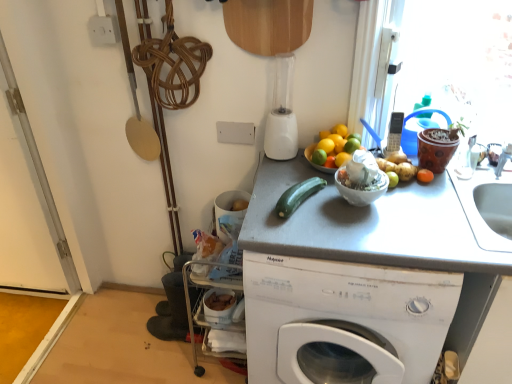
Question: Would you say gray matte counter top at center is inside or outside green smooth-textured zucchini at center?

Choices:
 (A) outside
 (B) inside

Answer: (A)

Question: Looking at the image, does gray matte counter top at center seem bigger or smaller compared to green smooth-textured zucchini at center?

Choices:
 (A) big
 (B) small

Answer: (A)

Question: Based on their relative distances, which object is farther from the white plastic phone at upper right?

Choices:
 (A) orange matte at upper right, the 2th orange viewed from the top
 (B) green matte lime at upper right, which is the second lime from left to right
 (C) green matte lime at center, positioned as the 1th lime in left-to-right order
 (D) orange matte at upper center, which is counted as the 1th orange, starting from the top
 (E) white plastic blender at upper center

Answer: (E)

Question: Which is farther from the gray matte counter top at center?

Choices:
 (A) orange matte at right
 (B) white matte washing machine at center
 (C) white plastic blender at upper center
 (D) green matte lime at center, positioned as the 1th lime in left-to-right order
 (E) white plastic phone at upper right

Answer: (E)